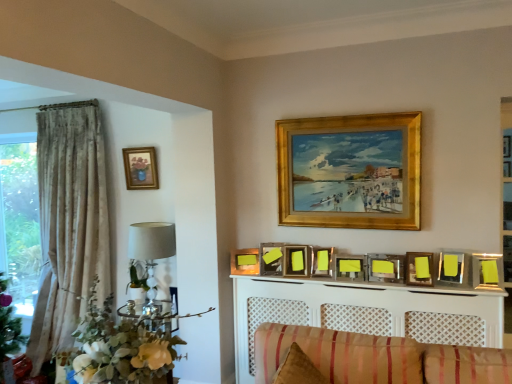
In order to click on green leafy floral arrangement at left in this screenshot , I will do `click(121, 346)`.

What is the approximate width of green leafy floral arrangement at left?

green leafy floral arrangement at left is 27.51 inches wide.

This screenshot has height=384, width=512. Describe the element at coordinates (322, 261) in the screenshot. I see `yellow matte picture frame at center, which ranks as the 5th picture frame in left-to-right order` at that location.

Image resolution: width=512 pixels, height=384 pixels. Identify the location of yellow matte picture frame at center, which ranks as the 5th picture frame in left-to-right order. (322, 261).

The height and width of the screenshot is (384, 512). I want to click on white fabric lampshade at left, so click(x=151, y=246).

Find the location of `yellow matte picture frame at upper center, the first picture frame positioned from the right`. yellow matte picture frame at upper center, the first picture frame positioned from the right is located at coordinates (487, 271).

What do you see at coordinates (385, 268) in the screenshot? The image size is (512, 384). I see `yellow paper at center, arranged as the fourth picture frame when viewed from the right` at bounding box center [385, 268].

What do you see at coordinates (296, 260) in the screenshot?
I see `matte wood picture frame at upper center, positioned as the fourth picture frame in left-to-right order` at bounding box center [296, 260].

What are the coordinates of `green leafy floral arrangement at left` in the screenshot? It's located at (121, 346).

Between yellow matte picture frame at upper center, which is the tenth picture frame from left to right, and yellow matte picture frame at center, arranged as the 5th picture frame when viewed from the right, which one appears on the left side from the viewer's perspective?

yellow matte picture frame at center, arranged as the 5th picture frame when viewed from the right.

From the image's perspective, is yellow matte picture frame at upper center, which is the tenth picture frame from left to right, located above or below yellow matte picture frame at center, the seventh picture frame positioned from the left?

yellow matte picture frame at upper center, which is the tenth picture frame from left to right, is situated higher than yellow matte picture frame at center, the seventh picture frame positioned from the left, in the image.

Is yellow matte picture frame at upper center, which is the tenth picture frame from left to right, behind yellow matte picture frame at center, the seventh picture frame positioned from the left?

No, it is in front of yellow matte picture frame at center, the seventh picture frame positioned from the left.

Find the location of `the 1st picture frame below the yellow paper at center, the eighth picture frame positioned from the left (from the image's perspective)`. the 1st picture frame below the yellow paper at center, the eighth picture frame positioned from the left (from the image's perspective) is located at coordinates (350, 268).

Is yellow paper at center, the eighth picture frame positioned from the left, inside or outside of yellow matte picture frame at center, the seventh picture frame positioned from the left?

yellow paper at center, the eighth picture frame positioned from the left, cannot be found inside yellow matte picture frame at center, the seventh picture frame positioned from the left.

How far apart are yellow paper at center, arranged as the fourth picture frame when viewed from the right, and yellow matte picture frame at center, arranged as the 5th picture frame when viewed from the right?

The distance of yellow paper at center, arranged as the fourth picture frame when viewed from the right, from yellow matte picture frame at center, arranged as the 5th picture frame when viewed from the right, is 5.15 inches.

Is yellow paper at center, the eighth picture frame positioned from the left, at the left side of yellow matte picture frame at center, arranged as the 5th picture frame when viewed from the right?

No.

Is white lattice fireplace at center facing towards matte yellow picture frame at center, positioned as the 2th picture frame in left-to-right order?

No.

From the image's perspective, relative to matte yellow picture frame at center, which appears as the tenth picture frame when viewed from the right, is white lattice fireplace at center above or below?

From the image's perspective, white lattice fireplace at center appears below matte yellow picture frame at center, which appears as the tenth picture frame when viewed from the right.

From a real-world perspective, which is physically above, white lattice fireplace at center or matte yellow picture frame at center, positioned as the 2th picture frame in left-to-right order?

matte yellow picture frame at center, positioned as the 2th picture frame in left-to-right order, is physically above.

Considering the sizes of white lattice fireplace at center and matte yellow picture frame at center, positioned as the 2th picture frame in left-to-right order, in the image, is white lattice fireplace at center taller or shorter than matte yellow picture frame at center, positioned as the 2th picture frame in left-to-right order,?

In the image, white lattice fireplace at center appears to be taller than matte yellow picture frame at center, positioned as the 2th picture frame in left-to-right order.

From a real-world perspective, is green leafy floral arrangement at left above or below yellow matte picture frame at center, arranged as the 5th picture frame when viewed from the right?

In terms of real-world spatial position, green leafy floral arrangement at left is below yellow matte picture frame at center, arranged as the 5th picture frame when viewed from the right.

Is green leafy floral arrangement at left not within yellow matte picture frame at center, the seventh picture frame positioned from the left?

Indeed, green leafy floral arrangement at left is completely outside yellow matte picture frame at center, the seventh picture frame positioned from the left.

Is green leafy floral arrangement at left looking in the opposite direction of yellow matte picture frame at center, the seventh picture frame positioned from the left?

green leafy floral arrangement at left is not turned away from yellow matte picture frame at center, the seventh picture frame positioned from the left.

Can you confirm if green leafy floral arrangement at left is thinner than yellow matte picture frame at center, arranged as the 5th picture frame when viewed from the right?

In fact, green leafy floral arrangement at left might be wider than yellow matte picture frame at center, arranged as the 5th picture frame when viewed from the right.

Where is `picture frame that is the 6th object located in front of the white fabric lampshade at left`? picture frame that is the 6th object located in front of the white fabric lampshade at left is located at coordinates (385, 268).

From the picture: Is white fabric lampshade at left oriented away from yellow paper at center, the eighth picture frame positioned from the left?

white fabric lampshade at left does not have its back to yellow paper at center, the eighth picture frame positioned from the left.

Does point (158, 229) come behind point (391, 264)?

Yes, point (158, 229) is farther from viewer.

Does white fabric lampshade at left touch yellow paper at center, the eighth picture frame positioned from the left?

No.

From a real-world perspective, does matte wood picture frame at upper center, positioned as the fourth picture frame in left-to-right order, sit lower than white lattice fireplace at center?

Incorrect, from a real-world perspective, matte wood picture frame at upper center, positioned as the fourth picture frame in left-to-right order, is higher than white lattice fireplace at center.

Locate an element on the screen. This screenshot has width=512, height=384. furniture in front of the matte wood picture frame at upper center, the eighth picture frame in the right-to-left sequence is located at coordinates (364, 312).

Is matte wood picture frame at upper center, the eighth picture frame in the right-to-left sequence, directly adjacent to white lattice fireplace at center?

There is a gap between matte wood picture frame at upper center, the eighth picture frame in the right-to-left sequence, and white lattice fireplace at center.

Based on the photo, is matte wood picture frame at upper center, the eighth picture frame in the right-to-left sequence, taller or shorter than white lattice fireplace at center?

matte wood picture frame at upper center, the eighth picture frame in the right-to-left sequence, is shorter than white lattice fireplace at center.

Which is behind, matte gold picture frame at upper left, the 1th picture frame positioned from the left, or yellow matte picture frame at center, which is the third picture frame in right-to-left order?

Positioned behind is matte gold picture frame at upper left, the 1th picture frame positioned from the left.

From a real-world perspective, is matte gold picture frame at upper left, the 1th picture frame positioned from the left, physically above yellow matte picture frame at center, which is the third picture frame in right-to-left order?

Yes, from a real-world perspective, matte gold picture frame at upper left, the 1th picture frame positioned from the left, is on top of yellow matte picture frame at center, which is the third picture frame in right-to-left order.

Consider the image. From the image's perspective, does matte gold picture frame at upper left, the 1th picture frame positioned from the left, appear higher than yellow matte picture frame at center, which is the ninth picture frame from left to right?

Yes, from the image's perspective, matte gold picture frame at upper left, the 1th picture frame positioned from the left, is over yellow matte picture frame at center, which is the ninth picture frame from left to right.

Is point (140, 150) closer to viewer compared to point (422, 275)?

That is False.

I want to click on picture frame that is the 4th one when counting downward from the yellow matte picture frame at upper center, which is the tenth picture frame from left to right (from the image's perspective), so click(350, 268).

Find the location of a particular element. The image size is (512, 384). the 1st picture frame counting from the right side of the yellow matte picture frame at center, arranged as the 5th picture frame when viewed from the right is located at coordinates (385, 268).

Which object lies nearer to the anchor point yellow paper at center, which is the 9th picture frame in right-to-left order, white lattice fireplace at center or white fabric lampshade at left?

white lattice fireplace at center is closer to yellow paper at center, which is the 9th picture frame in right-to-left order.

Considering their positions, is matte yellow picture frame at center, which appears as the tenth picture frame when viewed from the right, positioned closer to yellow matte picture frame at center, which is the third picture frame in right-to-left order, than yellow matte picture frame at upper center, which ranks as the second picture frame in right-to-left order?

yellow matte picture frame at upper center, which ranks as the second picture frame in right-to-left order, is closer to yellow matte picture frame at center, which is the third picture frame in right-to-left order.

Estimate the real-world distances between objects in this image. Which object is further from matte gold picture frame at upper left, the 1th picture frame positioned from the left, matte wood picture frame at upper center, positioned as the fourth picture frame in left-to-right order, or green leafy floral arrangement at left?

green leafy floral arrangement at left.

Looking at the image, which one is located further to yellow paper at center, which is the 3th picture frame from left to right, yellow matte picture frame at center, which is the ninth picture frame from left to right, or white lattice fireplace at center?

yellow matte picture frame at center, which is the ninth picture frame from left to right, is further to yellow paper at center, which is the 3th picture frame from left to right.

From the image, which object appears to be farther from yellow matte picture frame at center, which is the ninth picture frame from left to right, yellow paper at center, the eighth picture frame positioned from the left, or yellow matte picture frame at upper center, which is the tenth picture frame from left to right?

yellow matte picture frame at upper center, which is the tenth picture frame from left to right, is further to yellow matte picture frame at center, which is the ninth picture frame from left to right.

Based on the photo, considering their positions, is yellow paper at center, which is the 3th picture frame from left to right, positioned closer to yellow matte picture frame at upper center, which ranks as the second picture frame in right-to-left order, than gold wooden picture frame at upper center, the sixth picture frame from the left?

Among the two, gold wooden picture frame at upper center, the sixth picture frame from the left, is located nearer to yellow matte picture frame at upper center, which ranks as the second picture frame in right-to-left order.

When comparing their distances from gold wooden picture frame at upper center, the sixth picture frame from the left, does matte gold picture frame at upper left, the 11th picture frame when ordered from right to left, or white lattice fireplace at center seem closer?

Among the two, white lattice fireplace at center is located nearer to gold wooden picture frame at upper center, the sixth picture frame from the left.

Estimate the real-world distances between objects in this image. Which object is closer to green leafy floral arrangement at left, matte yellow picture frame at center, positioned as the 2th picture frame in left-to-right order, or yellow matte picture frame at center, which ranks as the 5th picture frame in left-to-right order?

matte yellow picture frame at center, positioned as the 2th picture frame in left-to-right order.

At what (x,y) coordinates should I click in order to perform the action: click on furniture located between matte yellow picture frame at center, positioned as the 2th picture frame in left-to-right order, and yellow matte picture frame at center, which is the third picture frame in right-to-left order, in the left-right direction. Please return your answer as a coordinate pair (x, y). The height and width of the screenshot is (384, 512). Looking at the image, I should click on (364, 312).

Where is `picture frame between matte gold picture frame at upper left, the 11th picture frame when ordered from right to left, and yellow paper at center, which is the 9th picture frame in right-to-left order, in the horizontal direction`? The height and width of the screenshot is (384, 512). picture frame between matte gold picture frame at upper left, the 11th picture frame when ordered from right to left, and yellow paper at center, which is the 9th picture frame in right-to-left order, in the horizontal direction is located at coordinates (245, 261).

Identify the location of furniture between matte gold picture frame at upper left, the 11th picture frame when ordered from right to left, and yellow matte picture frame at center, which is the third picture frame in right-to-left order, from left to right. (364, 312).

The width and height of the screenshot is (512, 384). I want to click on furniture located between green leafy floral arrangement at left and yellow matte picture frame at upper center, which is the tenth picture frame from left to right, in the left-right direction, so click(364, 312).